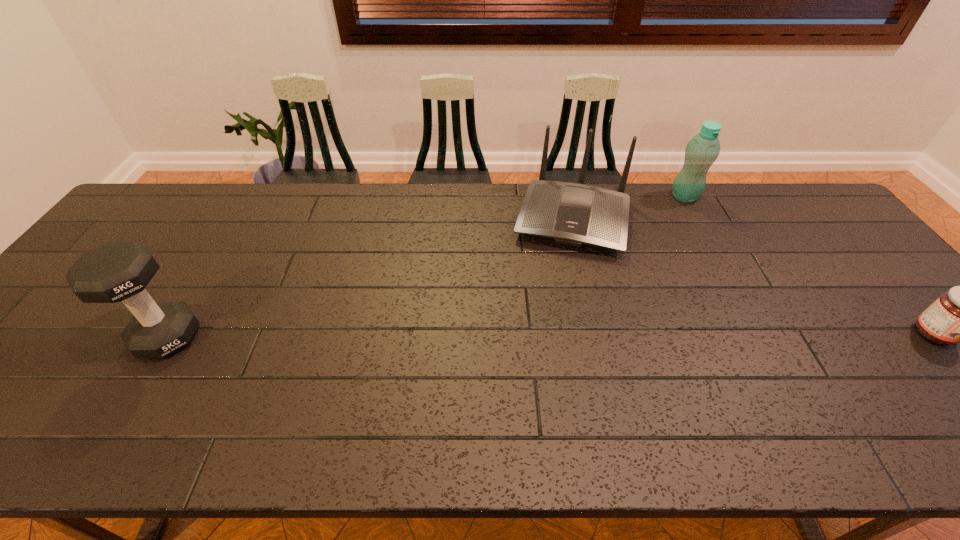
Find the location of `router located at the far edge`. router located at the far edge is located at coordinates [574, 214].

Image resolution: width=960 pixels, height=540 pixels. Identify the location of water bottle at the far edge. (702, 150).

Find the location of a particular element. This screenshot has height=540, width=960. vacant space at the far edge is located at coordinates (444, 225).

The height and width of the screenshot is (540, 960). Find the location of `free space at the near edge`. free space at the near edge is located at coordinates (616, 386).

This screenshot has height=540, width=960. Find the location of `vacant space at the left edge of the desktop`. vacant space at the left edge of the desktop is located at coordinates (114, 235).

Where is `free space at the far left corner of the desktop`? The width and height of the screenshot is (960, 540). free space at the far left corner of the desktop is located at coordinates (182, 187).

Where is `free location at the far right corner of the desktop`? Image resolution: width=960 pixels, height=540 pixels. free location at the far right corner of the desktop is located at coordinates (789, 211).

I want to click on free spot between the dumbbell and the water bottle, so click(x=426, y=267).

Find the location of a particular element. free area in between the leftmost object and the router is located at coordinates (370, 278).

Choose which object is the nearest neighbor to the second object from right to left. Please provide its 2D coordinates. Your answer should be formatted as a tuple, i.e. [(x, y)], where the tuple contains the x and y coordinates of a point satisfying the conditions above.

[(574, 214)]